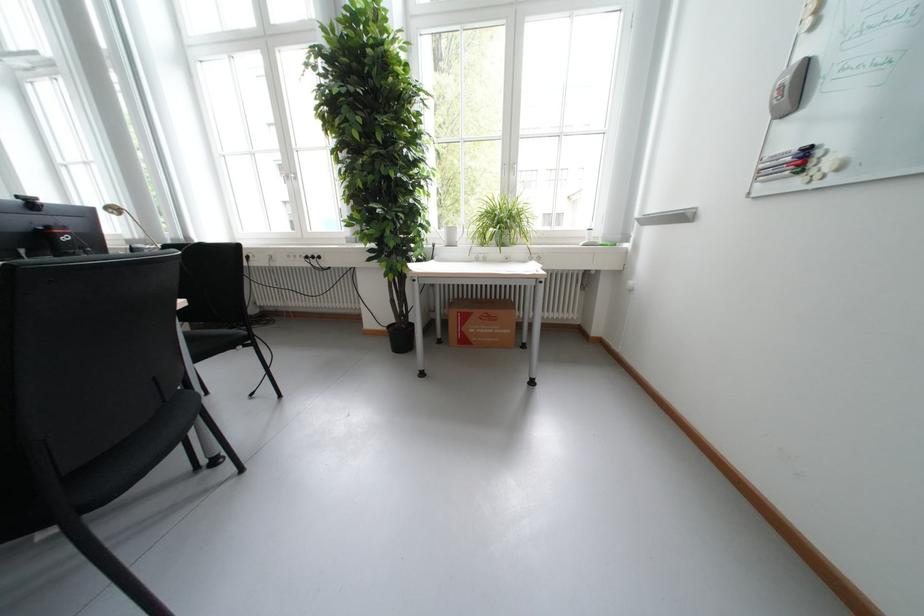
The height and width of the screenshot is (616, 924). What are the coordinates of `white cup` in the screenshot? It's located at (450, 235).